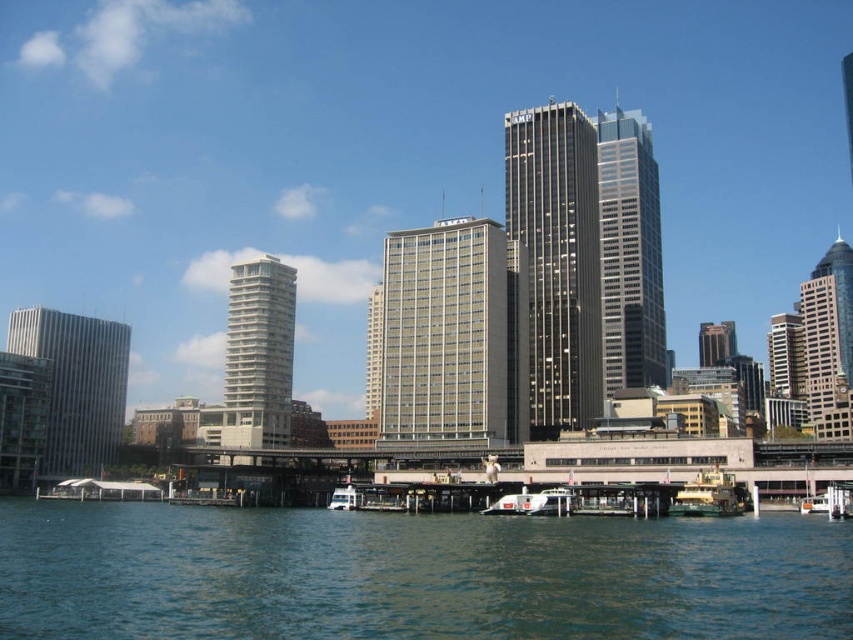
Question: Observing the image, what is the correct spatial positioning of dark gray glass skyscraper at center in reference to green painted metal ferry at lower center?

Choices:
 (A) below
 (B) above

Answer: (B)

Question: Does gray concrete building at center appear under white plastic boat at lower right?

Choices:
 (A) yes
 (B) no

Answer: (B)

Question: Among these objects, which one is farthest from the camera?

Choices:
 (A) white glossy tower at center
 (B) gray concrete building at center
 (C) dark gray glass skyscraper at center
 (D) gray glass building at left

Answer: (C)

Question: Which is nearer to the dark gray glass skyscraper at center?

Choices:
 (A) white matte boat at lower center
 (B) white plastic boat at lower right
 (C) blue-green water at lower center

Answer: (B)

Question: Estimate the real-world distances between objects in this image. Which object is farther from the green painted metal ferry at lower center?

Choices:
 (A) white glossy tower at center
 (B) white plastic boat at lower right
 (C) gray concrete building at center
 (D) gray glass building at left

Answer: (D)

Question: Does white glossy tower at center appear over white matte boat at lower center?

Choices:
 (A) no
 (B) yes

Answer: (B)